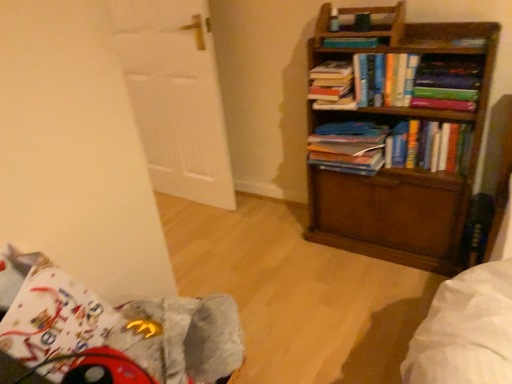
Question: Is white wooden door at left taller than hardcover book at upper right?

Choices:
 (A) no
 (B) yes

Answer: (B)

Question: Does white wooden door at left have a greater width compared to hardcover book at upper right?

Choices:
 (A) no
 (B) yes

Answer: (A)

Question: Is the position of white wooden door at left less distant than that of hardcover book at upper right?

Choices:
 (A) no
 (B) yes

Answer: (A)

Question: Would you say white wooden door at left is a long distance from hardcover book at upper right?

Choices:
 (A) yes
 (B) no

Answer: (A)

Question: Is white wooden door at left positioned with its back to hardcover book at upper right?

Choices:
 (A) yes
 (B) no

Answer: (B)

Question: From a real-world perspective, is hardcover books at center, the 1th book from the bottom, positioned above or below hardcover book at upper center, the 1th book positioned from the top?

Choices:
 (A) below
 (B) above

Answer: (A)

Question: In the image, is hardcover books at center, the 1th book from the bottom, positioned in front of or behind hardcover book at upper center, the fifth book positioned from the bottom?

Choices:
 (A) behind
 (B) front

Answer: (B)

Question: Considering the positions of hardcover books at center, the 1th book from the bottom, and hardcover book at upper center, the 1th book positioned from the top, in the image, is hardcover books at center, the 1th book from the bottom, taller or shorter than hardcover book at upper center, the 1th book positioned from the top,?

Choices:
 (A) tall
 (B) short

Answer: (A)

Question: From the image's perspective, is hardcover books at center, the 1th book from the bottom, located above or below hardcover book at upper center, the fifth book positioned from the bottom?

Choices:
 (A) below
 (B) above

Answer: (A)

Question: Based on their sizes in the image, would you say hardcover books at center, arranged as the 5th book when viewed from the top, is bigger or smaller than hardcover book at upper right?

Choices:
 (A) small
 (B) big

Answer: (B)

Question: Is point (400, 147) positioned closer to the camera than point (472, 81)?

Choices:
 (A) closer
 (B) farther

Answer: (B)

Question: Is hardcover books at center, arranged as the 5th book when viewed from the top, inside the boundaries of hardcover book at upper right, or outside?

Choices:
 (A) inside
 (B) outside

Answer: (B)

Question: From the image's perspective, is hardcover books at center, the 1th book from the bottom, above or below hardcover book at upper right?

Choices:
 (A) below
 (B) above

Answer: (A)

Question: Is hardcover book at upper center, the 1th book positioned from the top, taller or shorter than wooden bookcase at right?

Choices:
 (A) short
 (B) tall

Answer: (A)

Question: Is hardcover book at upper center, the fifth book positioned from the bottom, in front of or behind wooden bookcase at right in the image?

Choices:
 (A) behind
 (B) front

Answer: (A)